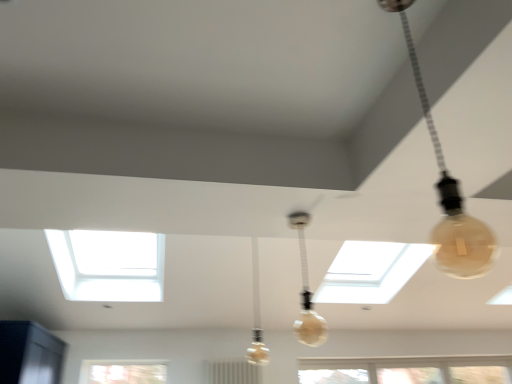
Question: From a real-world perspective, is translucent glass bulb at upper right, arranged as the 3th lamp when ordered from the bottom, physically located above or below translucent glass bulb at center, acting as the 2th lamp starting from the top?

Choices:
 (A) above
 (B) below

Answer: (A)

Question: In the image, is translucent glass bulb at upper right, which is the first lamp from top to bottom, positioned in front of or behind translucent glass bulb at center, acting as the second lamp starting from the back?

Choices:
 (A) front
 (B) behind

Answer: (A)

Question: Considering the real-world distances, which object is closest to the translucent glass bulb at center, the 2th lamp in the front-to-back sequence?

Choices:
 (A) translucent glass bulb at center, placed as the 1th lamp when sorted from back to front
 (B) translucent glass bulb at upper right, the first lamp positioned from the right

Answer: (A)

Question: Which object is positioned closest to the translucent glass bulb at center, acting as the second lamp starting from the right?

Choices:
 (A) translucent glass bulb at center, which ranks as the first lamp in left-to-right order
 (B) translucent glass bulb at upper right, which is the first lamp from top to bottom

Answer: (A)